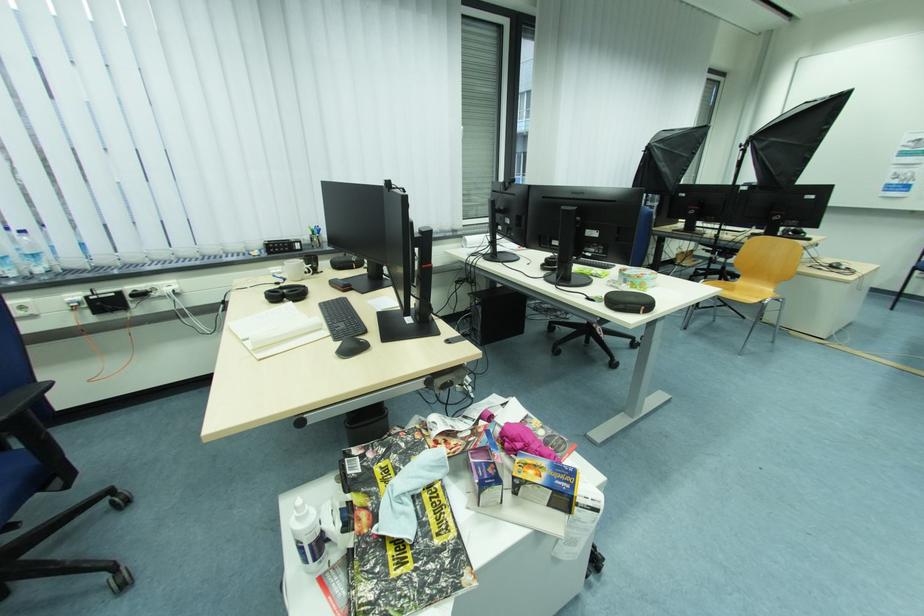
You are a GUI agent. You are given a task and a screenshot of the screen. Output one action in this format:
    pyautogui.click(x=<x>, y=<y>)
    Task: Click on the white mug handle
    This screenshot has height=616, width=924.
    Given the screenshot: What is the action you would take?
    pyautogui.click(x=310, y=264)